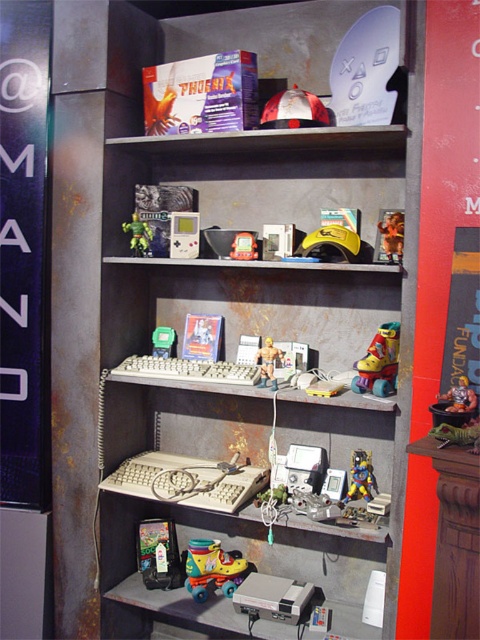
You are a collector looking to purchase items from the top shelf of the shelving unit. You see the metallic yellow roller skates at center and the green plastic toy at center. Which item is positioned closer to you?

The metallic yellow roller skates at center is closer to the viewer than the green plastic toy at center.

You are trying to place a new item on the shelf between the metallic yellow roller skates at center and the green plastic toy at center. The item is 10 cm thick. Can you fit it between them?

The metallic yellow roller skates at center is thinner than the green plastic toy at center. The space between them is determined by the thinner object, so the 10 cm thick item may not fit if the available space is less than 10 cm. However, without knowing the exact dimensions of the space, it is uncertain. Please check the actual distance between them.